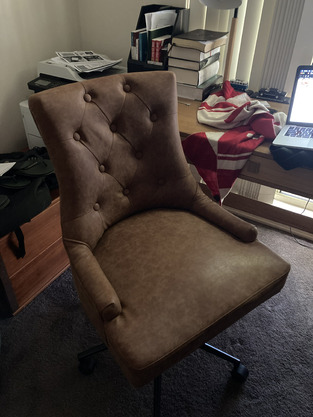
Where is `blinds`? This screenshot has width=313, height=417. blinds is located at coordinates (245, 35).